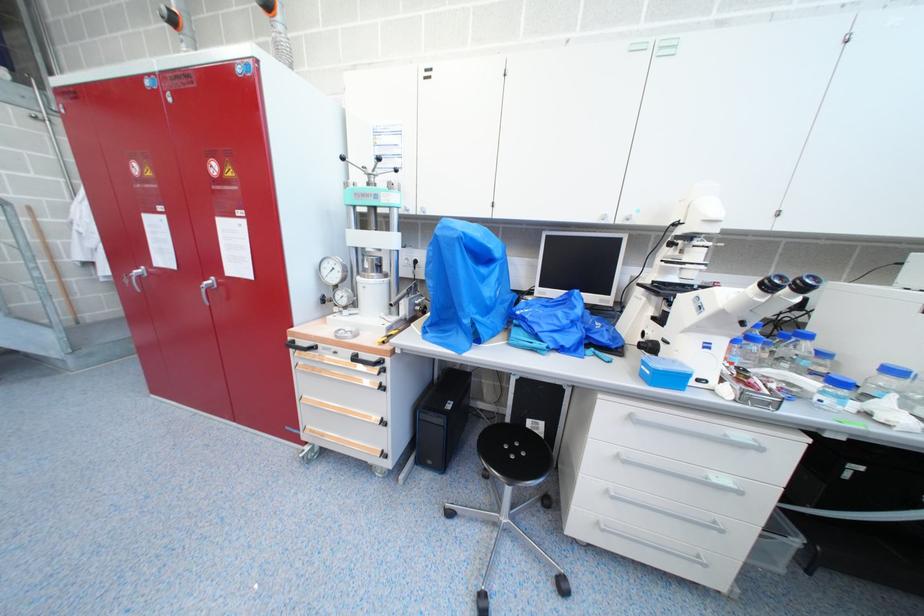
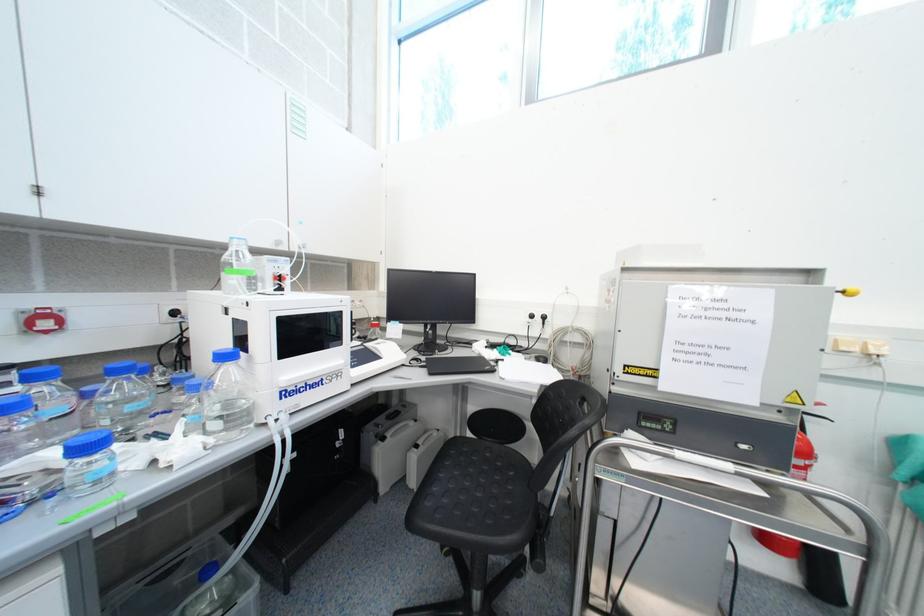
Question: The camera is either moving clockwise (left) or counter-clockwise (right) around the object. The first image is from the beginning of the video and the second image is from the end. Is the camera moving left or right when shooting the video?

Choices:
 (A) Left
 (B) Right

Answer: (A)